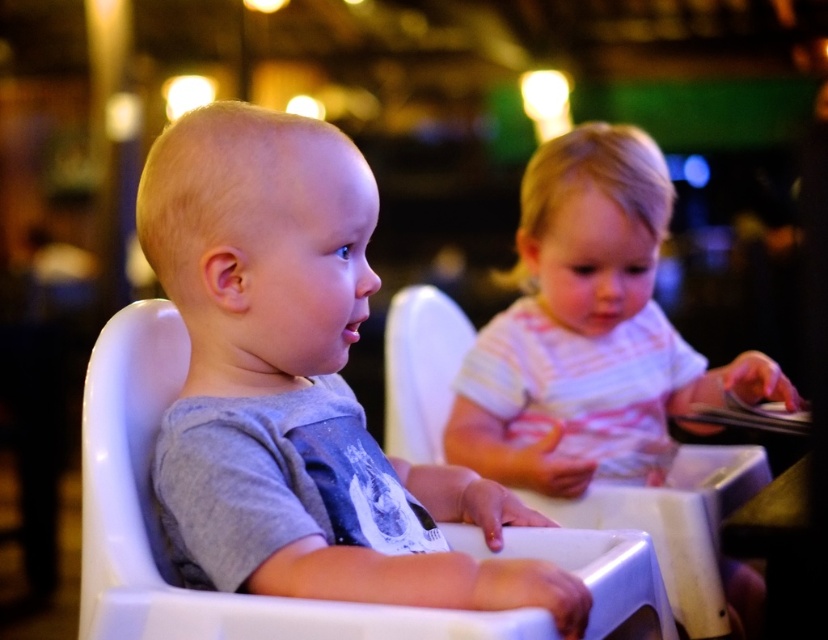
Question: Can you confirm if gray matte shirt at left is positioned to the right of striped cotton shirt at right?

Choices:
 (A) yes
 (B) no

Answer: (B)

Question: In this image, where is gray matte shirt at left located relative to striped cotton shirt at right?

Choices:
 (A) left
 (B) right

Answer: (A)

Question: Where is gray matte shirt at left located in relation to striped cotton shirt at right in the image?

Choices:
 (A) left
 (B) right

Answer: (A)

Question: Which object appears closest to the camera in this image?

Choices:
 (A) gray matte shirt at left
 (B) striped cotton shirt at right

Answer: (A)

Question: Which point is closer to the camera taking this photo?

Choices:
 (A) (547, 419)
 (B) (395, 508)

Answer: (B)